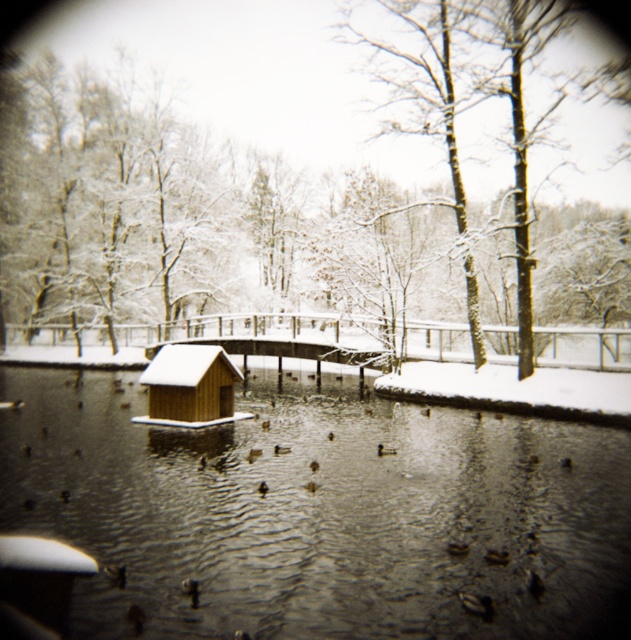
You are standing at the center of the pond and want to reach the wooden hut at center. Which direction should you move to reach it?

The wooden hut at center is located at point (189, 387), so you should move towards the direction of the coordinates to reach it.

You are a photographer trying to capture a clear shot of the brown matte duck at center. However, the wooden hut at center is blocking your view. Can you move the duck to the front to get a better shot?

The brown matte duck at center is behind the wooden hut at center, so moving it to the front would allow for a clearer shot without obstruction.